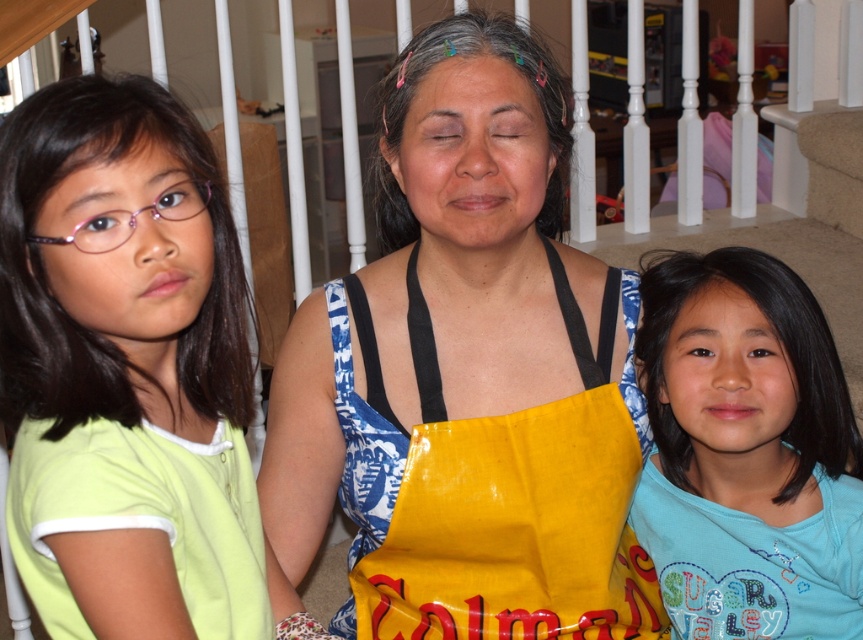
Based on the photo, who is higher up, blue cotton shirt at right or yellow fabric apron at center?

Positioned higher is blue cotton shirt at right.

Does point (841, 582) come closer to viewer compared to point (498, 516)?

No, (841, 582) is behind (498, 516).

You are a GUI agent. You are given a task and a screenshot of the screen. Output one action in this format:
    pyautogui.click(x=<x>, y=<y>)
    Task: Click on the blue cotton shirt at right
    The height and width of the screenshot is (640, 863).
    Given the screenshot: What is the action you would take?
    pyautogui.click(x=747, y=452)

Between light green shirt at left and yellow fabric apron at center, which one appears on the left side from the viewer's perspective?

From the viewer's perspective, light green shirt at left appears more on the left side.

Can you confirm if light green shirt at left is bigger than yellow fabric apron at center?

Incorrect, light green shirt at left is not larger than yellow fabric apron at center.

Is point (49, 220) behind point (589, 531)?

No, (49, 220) is in front of (589, 531).

This screenshot has width=863, height=640. I want to click on light green shirt at left, so click(118, 268).

Between light green shirt at left and blue cotton shirt at right, which one has less height?

light green shirt at left is shorter.

In the scene shown: Is light green shirt at left shorter than blue cotton shirt at right?

Yes, light green shirt at left is shorter than blue cotton shirt at right.

I want to click on light green shirt at left, so click(118, 268).

Locate an element on the screen. light green shirt at left is located at coordinates (118, 268).